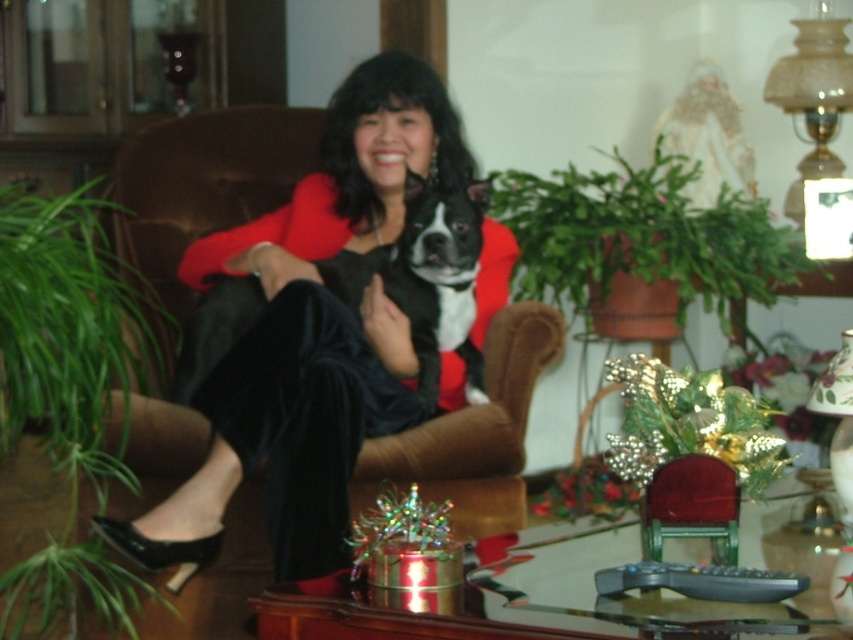
You are a photographer trying to capture a closeup of the velvet black dress at center without the black and white fur at center appearing in the shot. Is this possible based on their positions?

The velvet black dress at center is in front of the black and white fur at center, so it is possible to capture a closeup of the velvet black dress at center without the black and white fur at center appearing in the shot by focusing on the dress and ensuring the fur is out of frame.

You are a photographer setting up for a portrait session. You notice the velvet black dress at center and the black and white fur at center in the scene. Which object should you adjust your camera focus to first if you want to capture both subjects clearly in the frame?

The velvet black dress at center is to the left of black and white fur at center, so you should focus on the velvet black dress at center first as it is closer to the left side of the frame.

You are a fashion designer who needs to create a new outfit. You observe the velvet black dress at center and the black and white fur at center in the image. Which of these items has a greater width?

The velvet black dress at center has a greater width than the black and white fur at center.